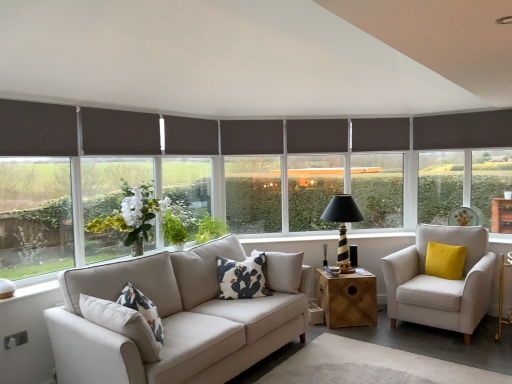
Question: Is black striped wood table lamp at center wider or thinner than light beige fabric armchair at right?

Choices:
 (A) thin
 (B) wide

Answer: (A)

Question: Is point (340, 243) closer or farther from the camera than point (423, 223)?

Choices:
 (A) closer
 (B) farther

Answer: (A)

Question: Based on their relative distances, which object is nearer to the light beige fabric armchair at right?

Choices:
 (A) dark gray roller blind at center, acting as the 1th window screen starting from the right
 (B) yellow velvet pillow at right, which is the first pillow in back-to-front order
 (C) dark gray roller blind at left, the 1th window screen viewed from the front
 (D) white matte vase at center
 (E) black striped wood table lamp at center

Answer: (B)

Question: Which is nearer to the dark gray roller blind at center, the 1th window screen from the back?

Choices:
 (A) yellow velvet pillow at right, which appears as the second pillow when viewed from the left
 (B) black striped wood table lamp at center
 (C) white matte vase at center
 (D) wooden cube at center
 (E) dark brown roller blind at center

Answer: (E)